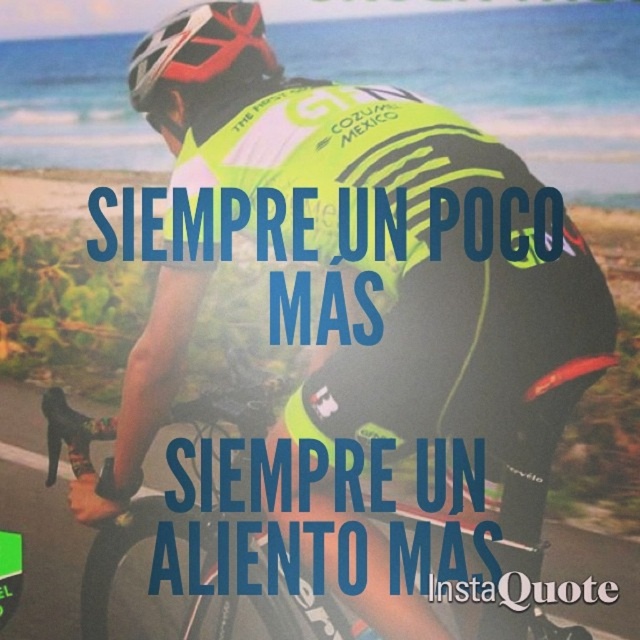
Is matte black helmet at upper center shorter than neon yellow fabric at center?

In fact, matte black helmet at upper center may be taller than neon yellow fabric at center.

Who is more distant from viewer, [141,108] or [60,417]?

Positioned behind is point [60,417].

Is point (262, 22) closer to camera compared to point (51, 401)?

Yes, point (262, 22) is closer to viewer.

Image resolution: width=640 pixels, height=640 pixels. Find the location of `matte black helmet at upper center`. matte black helmet at upper center is located at coordinates [x=198, y=52].